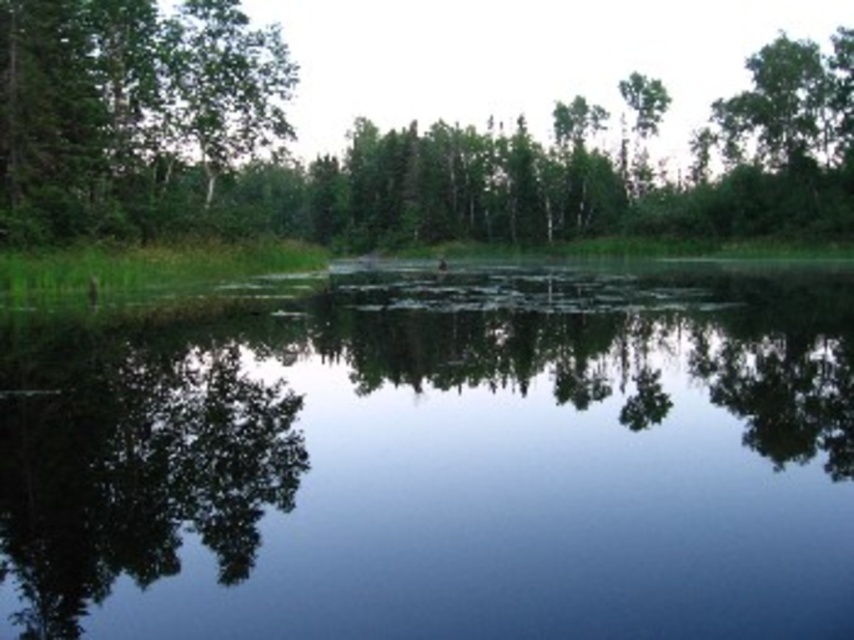
Question: Is green leafy tree at upper center positioned at the back of green matte tree at upper left?

Choices:
 (A) no
 (B) yes

Answer: (B)

Question: Is the position of green leafy tree at upper center more distant than that of green matte tree at upper left?

Choices:
 (A) yes
 (B) no

Answer: (A)

Question: Which object appears closest to the camera in this image?

Choices:
 (A) transparent water at center
 (B) green matte tree at upper left
 (C) green leafy tree at upper center

Answer: (A)

Question: Which point is closer to the camera?

Choices:
 (A) green leafy tree at upper center
 (B) transparent water at center

Answer: (B)

Question: Can you confirm if transparent water at center is thinner than green leafy tree at upper center?

Choices:
 (A) yes
 (B) no

Answer: (A)

Question: Which object is closer to the camera taking this photo?

Choices:
 (A) green matte tree at upper left
 (B) green leafy tree at upper center
 (C) transparent water at center

Answer: (C)